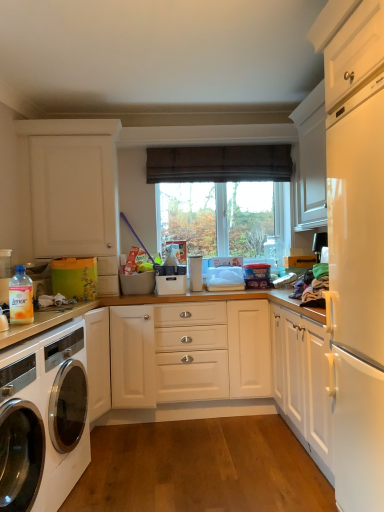
Question: Is brown fabric curtain at center in front of or behind white glossy washing machine at lower left in the image?

Choices:
 (A) behind
 (B) front

Answer: (A)

Question: Is point (150, 155) closer or farther from the camera than point (39, 337)?

Choices:
 (A) closer
 (B) farther

Answer: (B)

Question: Which object is the farthest from the white plastic container at center?

Choices:
 (A) white glossy washing machine at lower left
 (B) brown fabric curtain at center
 (C) white matte cabinet at upper left
 (D) transparent glass window at center
 (E) translucent plastic bottle at lower left

Answer: (A)

Question: Considering the real-world distances, which object is closest to the white plastic container at center?

Choices:
 (A) white glossy washing machine at lower left
 (B) white matte cabinet at upper left
 (C) transparent glass window at center
 (D) brown fabric curtain at center
 (E) translucent plastic bottle at lower left

Answer: (C)